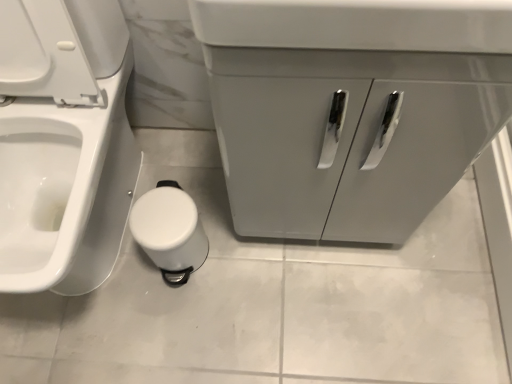
Question: Is matte gray cabinet at center oriented away from white glossy toilet at lower left?

Choices:
 (A) no
 (B) yes

Answer: (A)

Question: Is matte gray cabinet at center shorter than white glossy toilet at lower left?

Choices:
 (A) yes
 (B) no

Answer: (A)

Question: Can you confirm if matte gray cabinet at center is taller than white glossy toilet at lower left?

Choices:
 (A) no
 (B) yes

Answer: (A)

Question: Considering the relative sizes of matte gray cabinet at center and white glossy toilet at lower left in the image provided, is matte gray cabinet at center wider than white glossy toilet at lower left?

Choices:
 (A) yes
 (B) no

Answer: (B)

Question: From the image's perspective, is matte gray cabinet at center above white glossy toilet at lower left?

Choices:
 (A) no
 (B) yes

Answer: (B)

Question: Considering the positions of white plastic toilet paper at lower center and white glossy toilet at lower left in the image, is white plastic toilet paper at lower center taller or shorter than white glossy toilet at lower left?

Choices:
 (A) short
 (B) tall

Answer: (A)

Question: From the image's perspective, is white plastic toilet paper at lower center above or below white glossy toilet at lower left?

Choices:
 (A) below
 (B) above

Answer: (A)

Question: Is white plastic toilet paper at lower center wider or thinner than white glossy toilet at lower left?

Choices:
 (A) wide
 (B) thin

Answer: (B)

Question: Is white plastic toilet paper at lower center to the left or to the right of white glossy toilet at lower left in the image?

Choices:
 (A) right
 (B) left

Answer: (A)

Question: Does point (254, 64) appear closer or farther from the camera than point (181, 210)?

Choices:
 (A) closer
 (B) farther

Answer: (A)

Question: From the image's perspective, is matte gray cabinet at center located above or below white plastic toilet paper at lower center?

Choices:
 (A) above
 (B) below

Answer: (A)

Question: Is matte gray cabinet at center taller or shorter than white plastic toilet paper at lower center?

Choices:
 (A) tall
 (B) short

Answer: (A)

Question: Is matte gray cabinet at center inside or outside of white plastic toilet paper at lower center?

Choices:
 (A) outside
 (B) inside

Answer: (A)

Question: From a real-world perspective, relative to matte gray cabinet at center, is white glossy toilet at lower left vertically above or below?

Choices:
 (A) below
 (B) above

Answer: (B)

Question: From their relative heights in the image, would you say white glossy toilet at lower left is taller or shorter than matte gray cabinet at center?

Choices:
 (A) tall
 (B) short

Answer: (A)